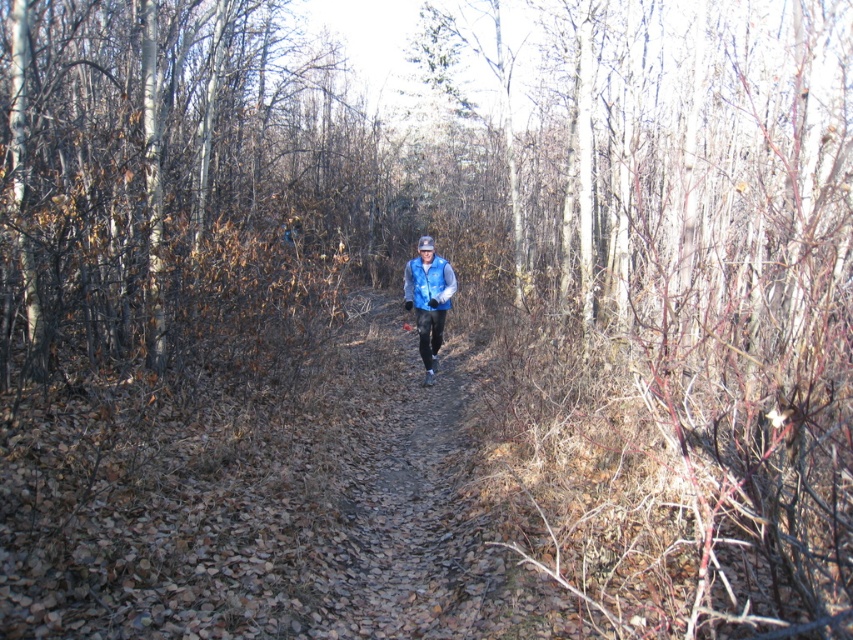
You are a hiker planning to walk along the path in the forest. You notice the brown bark tree at left and the blue fleece vest at center. Which object is bigger in size?

The brown bark tree at left is larger in size than the blue fleece vest at center.

You are standing at the center of the image and want to walk towards the brown bark tree at left. In which direction should you move?

You should move to the left to reach the brown bark tree at left since it is located at the left side of the image.

From the picture: You are a hiker walking along the path in the forest. You want to reach the point marked at coordinates (148, 305). There is another point at (422, 273). Which point is closer to your current position if you are facing the direction the person in the image is walking?

Point (148, 305) is in front of point (422, 273), so the point at (148, 305) is closer to your current position when facing the direction the person is walking.